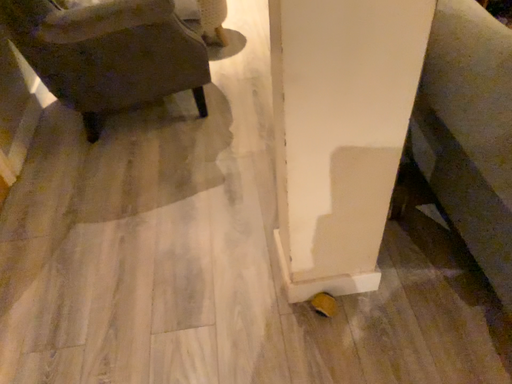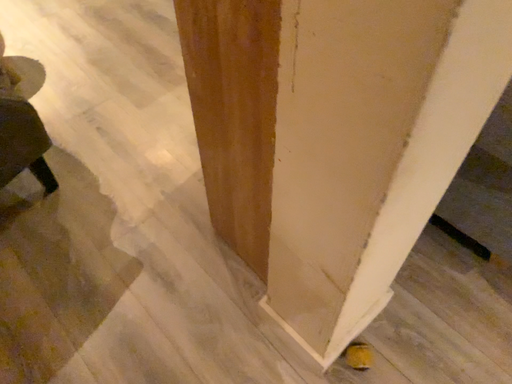
Question: Which way did the camera rotate in the video?

Choices:
 (A) rotated right
 (B) rotated left

Answer: (A)